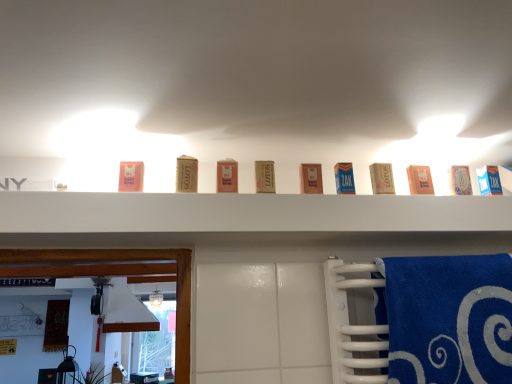
Question: Can you confirm if pink cardboard box at center, which is the eighth product in left-to-right order, is positioned to the left of blue soft towel at right?

Choices:
 (A) no
 (B) yes

Answer: (B)

Question: Does pink cardboard box at center, which is the eighth product in left-to-right order, contain blue soft towel at right?

Choices:
 (A) yes
 (B) no

Answer: (B)

Question: Is the position of pink cardboard box at center, the 3th product when ordered from right to left, more distant than that of blue soft towel at right?

Choices:
 (A) yes
 (B) no

Answer: (A)

Question: Are pink cardboard box at center, the 3th product when ordered from right to left, and blue soft towel at right far apart?

Choices:
 (A) no
 (B) yes

Answer: (A)

Question: From a real-world perspective, is pink cardboard box at center, which is the eighth product in left-to-right order, under blue soft towel at right?

Choices:
 (A) yes
 (B) no

Answer: (B)

Question: Is pink cardboard box at center, the 3th product when ordered from right to left, in front of blue soft towel at right?

Choices:
 (A) no
 (B) yes

Answer: (A)

Question: From the image's perspective, is blue soft towel at right below white cardboard box at upper center, which is the 2th product in right-to-left order?

Choices:
 (A) yes
 (B) no

Answer: (A)

Question: Is blue soft towel at right behind white cardboard box at upper center, which is the 2th product in right-to-left order?

Choices:
 (A) yes
 (B) no

Answer: (B)

Question: Is blue soft towel at right shorter than white cardboard box at upper center, which is the 2th product in right-to-left order?

Choices:
 (A) no
 (B) yes

Answer: (A)

Question: Can you confirm if blue soft towel at right is wider than white cardboard box at upper center, which is the 2th product in right-to-left order?

Choices:
 (A) yes
 (B) no

Answer: (A)

Question: Can you confirm if blue soft towel at right is positioned to the left of white cardboard box at upper center, which is the 2th product in right-to-left order?

Choices:
 (A) yes
 (B) no

Answer: (A)

Question: Considering the relative positions of blue soft towel at right and white cardboard box at upper center, which is the 2th product in right-to-left order, in the image provided, is blue soft towel at right to the right of white cardboard box at upper center, which is the 2th product in right-to-left order, from the viewer's perspective?

Choices:
 (A) no
 (B) yes

Answer: (A)

Question: Can you confirm if matte cardboard box at center, which is the 5th product from left to right, is positioned to the left of blue soft towel at right?

Choices:
 (A) yes
 (B) no

Answer: (A)